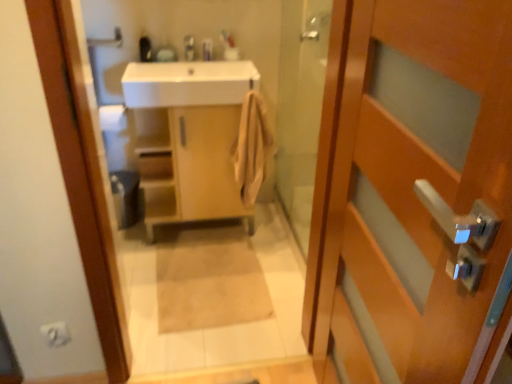
Question: Are light wood cabinet at center and white matte toilet paper at lower left making contact?

Choices:
 (A) yes
 (B) no

Answer: (B)

Question: Considering the relative sizes of light wood cabinet at center and white matte toilet paper at lower left in the image provided, is light wood cabinet at center smaller than white matte toilet paper at lower left?

Choices:
 (A) yes
 (B) no

Answer: (B)

Question: Is light wood cabinet at center positioned behind white matte toilet paper at lower left?

Choices:
 (A) no
 (B) yes

Answer: (B)

Question: Is the depth of light wood cabinet at center less than that of white matte toilet paper at lower left?

Choices:
 (A) yes
 (B) no

Answer: (B)

Question: Is light wood cabinet at center not inside white matte toilet paper at lower left?

Choices:
 (A) no
 (B) yes

Answer: (B)

Question: From the image's perspective, is wooden door at right positioned above or below matte silver faucet at upper center?

Choices:
 (A) below
 (B) above

Answer: (A)

Question: Is point (476, 1) closer or farther from the camera than point (192, 56)?

Choices:
 (A) farther
 (B) closer

Answer: (B)

Question: From a real-world perspective, is wooden door at right above or below matte silver faucet at upper center?

Choices:
 (A) below
 (B) above

Answer: (A)

Question: Considering their positions, is wooden door at right located in front of or behind matte silver faucet at upper center?

Choices:
 (A) behind
 (B) front

Answer: (B)

Question: Is matte plastic toothbrush at upper center wider or thinner than matte wooden mirror at upper center?

Choices:
 (A) wide
 (B) thin

Answer: (B)

Question: Considering their positions, is matte plastic toothbrush at upper center located in front of or behind matte wooden mirror at upper center?

Choices:
 (A) behind
 (B) front

Answer: (A)

Question: Based on their sizes in the image, would you say matte plastic toothbrush at upper center is bigger or smaller than matte wooden mirror at upper center?

Choices:
 (A) small
 (B) big

Answer: (A)

Question: From a real-world perspective, is matte plastic toothbrush at upper center positioned above or below matte wooden mirror at upper center?

Choices:
 (A) below
 (B) above

Answer: (B)

Question: Is beige fabric bath mat at center wider or thinner than white matte toilet paper at lower left?

Choices:
 (A) wide
 (B) thin

Answer: (A)

Question: Is point coord(173,233) closer or farther from the camera than point coord(64,342)?

Choices:
 (A) closer
 (B) farther

Answer: (B)